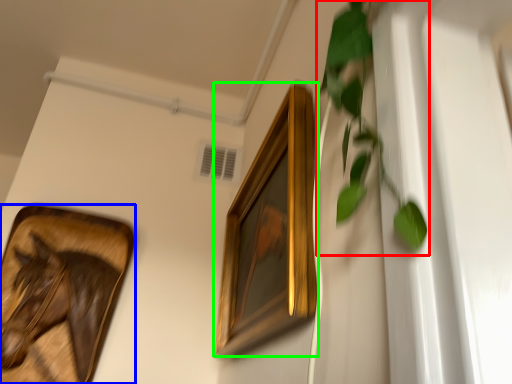
Question: Which object is positioned closest to vegetation (highlighted by a red box)? Select from picture frame (highlighted by a blue box) and picture frame (highlighted by a green box).

Choices:
 (A) picture frame
 (B) picture frame

Answer: (B)